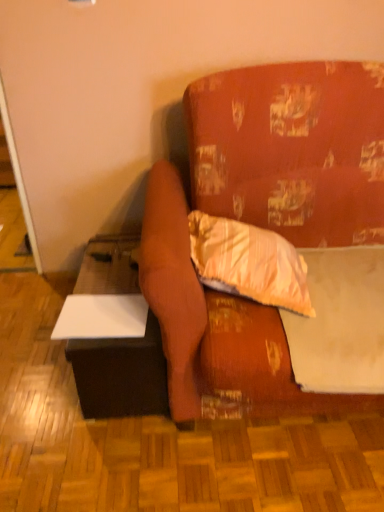
Question: Can you confirm if striped fabric pillow at center is smaller than white matte sheet at upper right?

Choices:
 (A) yes
 (B) no

Answer: (A)

Question: Considering the relative sizes of striped fabric pillow at center and white matte sheet at upper right in the image provided, is striped fabric pillow at center bigger than white matte sheet at upper right?

Choices:
 (A) yes
 (B) no

Answer: (B)

Question: From the image's perspective, is striped fabric pillow at center on top of white matte sheet at upper right?

Choices:
 (A) yes
 (B) no

Answer: (A)

Question: Is striped fabric pillow at center positioned with its back to white matte sheet at upper right?

Choices:
 (A) no
 (B) yes

Answer: (A)

Question: Is striped fabric pillow at center at the right side of white matte sheet at upper right?

Choices:
 (A) no
 (B) yes

Answer: (A)

Question: From a real-world perspective, is white matte table at lower left physically located above or below textured orange couch at center?

Choices:
 (A) below
 (B) above

Answer: (A)

Question: From the image's perspective, is white matte table at lower left above or below textured orange couch at center?

Choices:
 (A) above
 (B) below

Answer: (B)

Question: Considering the positions of white matte table at lower left and textured orange couch at center in the image, is white matte table at lower left taller or shorter than textured orange couch at center?

Choices:
 (A) tall
 (B) short

Answer: (B)

Question: In the image, is white matte table at lower left on the left side or the right side of textured orange couch at center?

Choices:
 (A) right
 (B) left

Answer: (B)

Question: Which is correct: white matte sheet at upper right is inside white matte table at lower left, or outside of it?

Choices:
 (A) outside
 (B) inside

Answer: (A)

Question: From a real-world perspective, is white matte sheet at upper right physically located above or below white matte table at lower left?

Choices:
 (A) above
 (B) below

Answer: (A)

Question: From the image's perspective, relative to white matte table at lower left, is white matte sheet at upper right above or below?

Choices:
 (A) above
 (B) below

Answer: (A)

Question: Considering the positions of point (332, 309) and point (124, 361), is point (332, 309) closer or farther from the camera than point (124, 361)?

Choices:
 (A) farther
 (B) closer

Answer: (B)

Question: Considering the relative positions of textured orange couch at center and white matte sheet at upper right in the image provided, is textured orange couch at center to the left or to the right of white matte sheet at upper right?

Choices:
 (A) left
 (B) right

Answer: (A)

Question: From a real-world perspective, is textured orange couch at center above or below white matte sheet at upper right?

Choices:
 (A) below
 (B) above

Answer: (B)